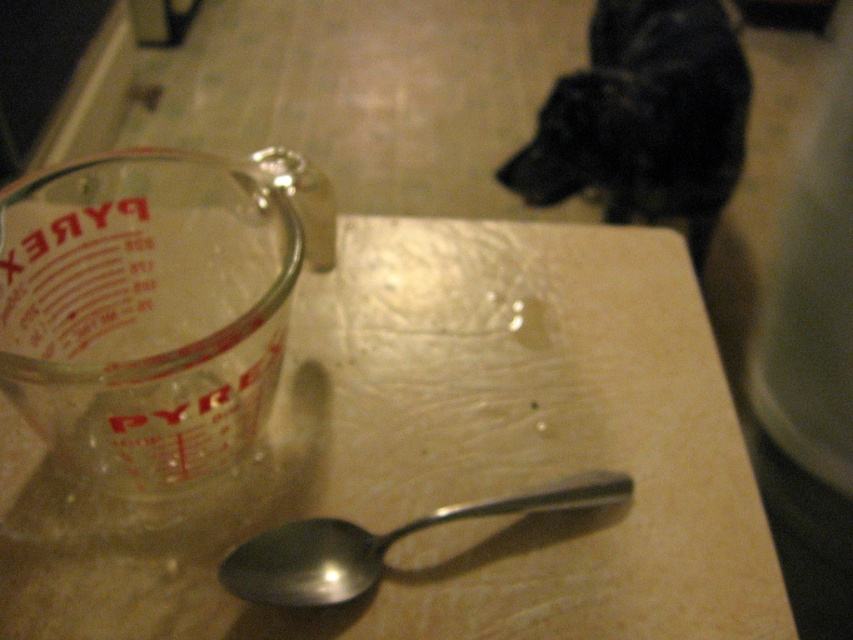
Question: Is black fur dog at upper right positioned in front of silver metallic spoon at center?

Choices:
 (A) yes
 (B) no

Answer: (B)

Question: Which object appears closest to the camera in this image?

Choices:
 (A) matte glass measuring cup at left
 (B) silver metallic spoon at center
 (C) black fur dog at upper right

Answer: (B)

Question: Which object is the farthest from the silver metallic spoon at center?

Choices:
 (A) black fur dog at upper right
 (B) matte glass measuring cup at left

Answer: (A)

Question: Is matte glass measuring cup at left wider than black fur dog at upper right?

Choices:
 (A) no
 (B) yes

Answer: (A)

Question: Which of the following is the farthest from the observer?

Choices:
 (A) black fur dog at upper right
 (B) matte glass measuring cup at left
 (C) silver metallic spoon at center

Answer: (A)

Question: Is black fur dog at upper right below silver metallic spoon at center?

Choices:
 (A) no
 (B) yes

Answer: (A)